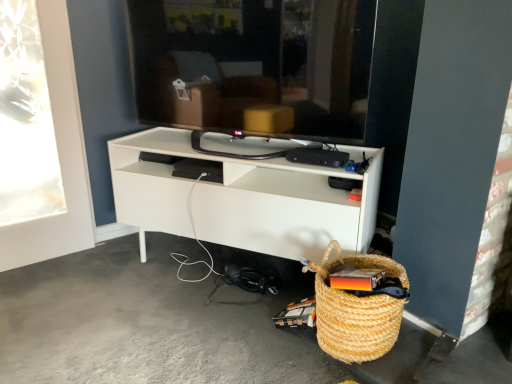
Question: Considering the relative positions of woven straw basket at lower right and gray concrete floor at lower left in the image provided, is woven straw basket at lower right to the right of gray concrete floor at lower left from the viewer's perspective?

Choices:
 (A) yes
 (B) no

Answer: (A)

Question: From the image's perspective, is woven straw basket at lower right beneath gray concrete floor at lower left?

Choices:
 (A) no
 (B) yes

Answer: (A)

Question: Considering the relative positions of woven straw basket at lower right and gray concrete floor at lower left in the image provided, is woven straw basket at lower right in front of gray concrete floor at lower left?

Choices:
 (A) yes
 (B) no

Answer: (B)

Question: Is woven straw basket at lower right to the left of gray concrete floor at lower left from the viewer's perspective?

Choices:
 (A) yes
 (B) no

Answer: (B)

Question: Is the position of woven straw basket at lower right more distant than that of gray concrete floor at lower left?

Choices:
 (A) no
 (B) yes

Answer: (B)

Question: Is point (92, 281) positioned closer to the camera than point (287, 122)?

Choices:
 (A) farther
 (B) closer

Answer: (A)

Question: From a real-world perspective, is gray concrete floor at lower left positioned above or below black glossy tv at center?

Choices:
 (A) above
 (B) below

Answer: (B)

Question: In terms of height, does gray concrete floor at lower left look taller or shorter compared to black glossy tv at center?

Choices:
 (A) short
 (B) tall

Answer: (A)

Question: Considering the positions of gray concrete floor at lower left and black glossy tv at center in the image, is gray concrete floor at lower left wider or thinner than black glossy tv at center?

Choices:
 (A) thin
 (B) wide

Answer: (B)

Question: In the image, is woven straw basket at lower right on the left side or the right side of gray concrete floor at lower left?

Choices:
 (A) left
 (B) right

Answer: (B)

Question: From the image's perspective, is woven straw basket at lower right positioned above or below gray concrete floor at lower left?

Choices:
 (A) below
 (B) above

Answer: (B)

Question: Is woven straw basket at lower right bigger or smaller than gray concrete floor at lower left?

Choices:
 (A) big
 (B) small

Answer: (B)

Question: In the image, is woven straw basket at lower right positioned in front of or behind gray concrete floor at lower left?

Choices:
 (A) front
 (B) behind

Answer: (B)

Question: Considering the positions of black glossy tv at center and woven straw basket at lower right in the image, is black glossy tv at center taller or shorter than woven straw basket at lower right?

Choices:
 (A) tall
 (B) short

Answer: (A)

Question: Considering the positions of black glossy tv at center and woven straw basket at lower right in the image, is black glossy tv at center wider or thinner than woven straw basket at lower right?

Choices:
 (A) thin
 (B) wide

Answer: (A)